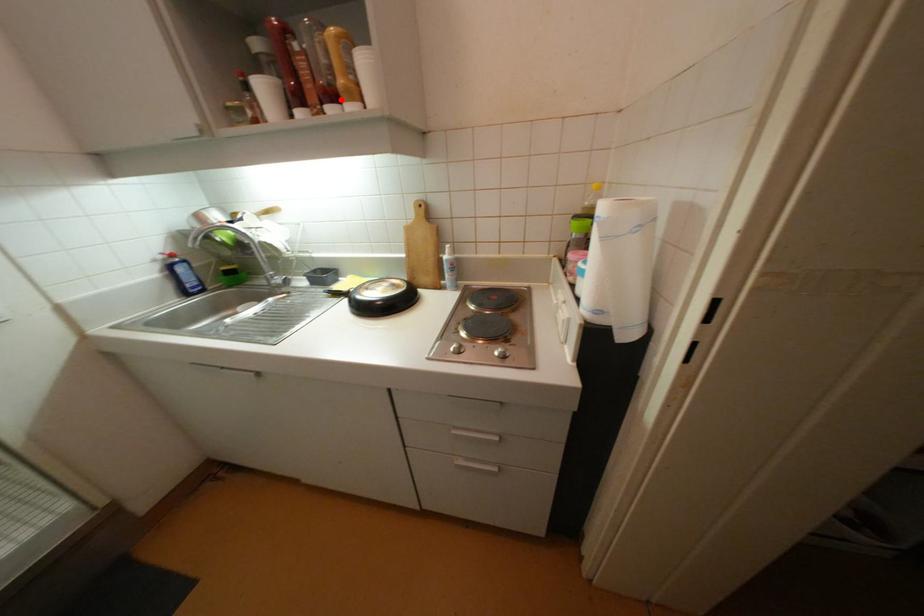
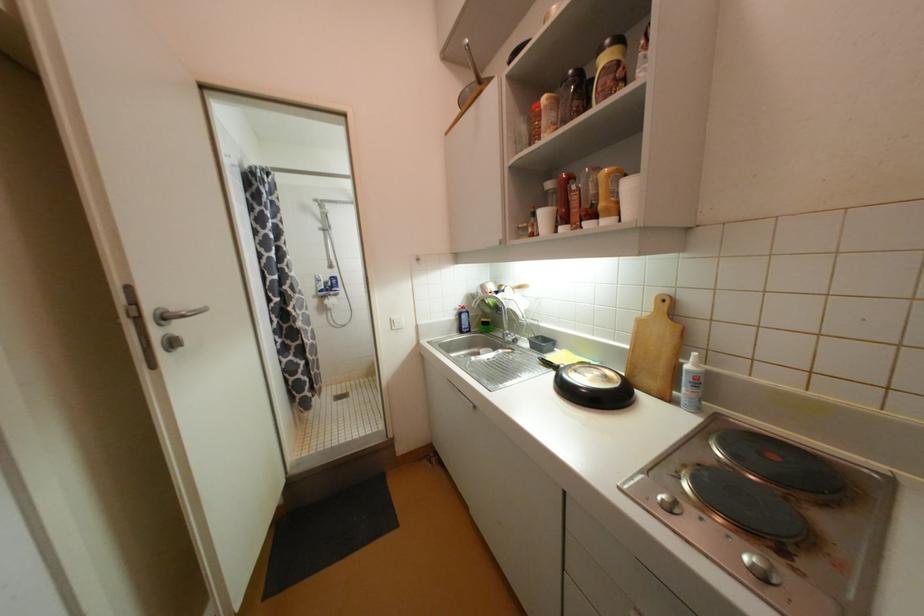
Where in the second image is the point corresponding to the highlighted location from the first image?

(600, 217)